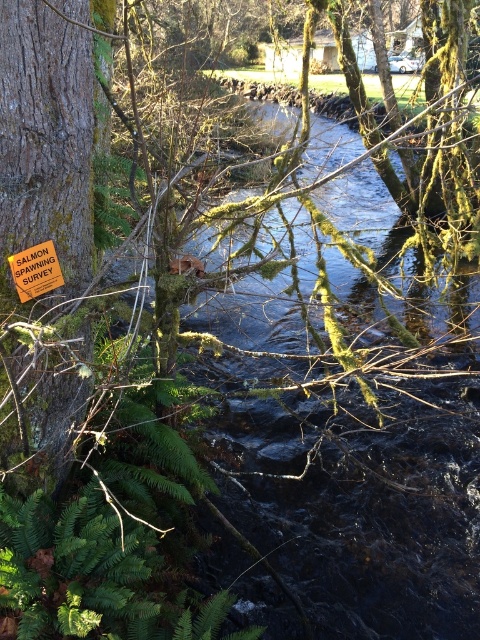
How distant is smooth brown bark at left from orange plastic sign at left?

smooth brown bark at left and orange plastic sign at left are 24.29 centimeters apart.

Consider the image. Can you confirm if smooth brown bark at left is thinner than orange plastic sign at left?

Incorrect, smooth brown bark at left's width is not less than orange plastic sign at left's.

Locate an element on the screen. smooth brown bark at left is located at coordinates (46, 140).

Find the location of a particular element. smooth brown bark at left is located at coordinates (46, 140).